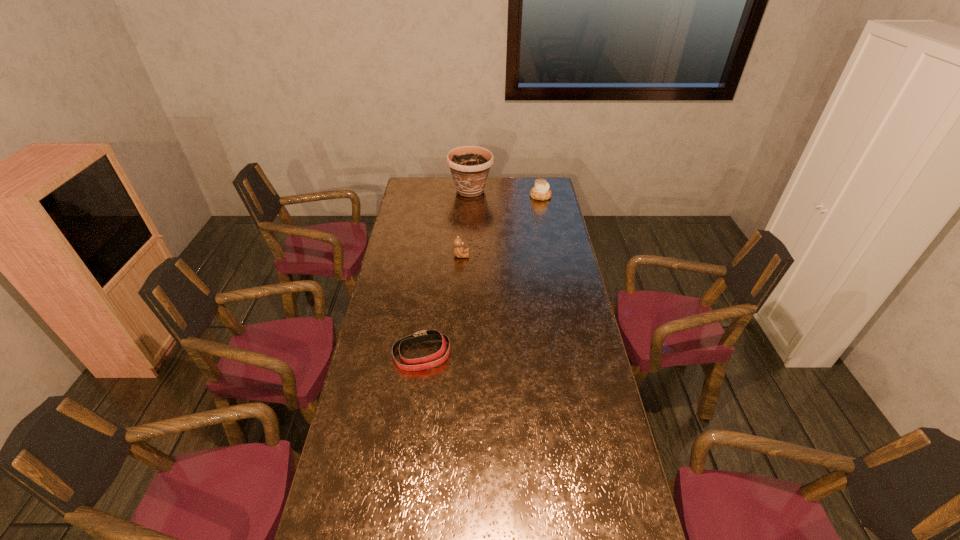
Image resolution: width=960 pixels, height=540 pixels. I want to click on the tallest object, so click(469, 165).

Identify the location of the rightmost object. This screenshot has height=540, width=960. (541, 191).

Identify the location of the third farthest object. This screenshot has height=540, width=960. (458, 249).

Locate an element on the screen. Image resolution: width=960 pixels, height=540 pixels. the nearest object is located at coordinates (426, 362).

Locate an element on the screen. Image resolution: width=960 pixels, height=540 pixels. the shortest object is located at coordinates (426, 362).

You are a GUI agent. You are given a task and a screenshot of the screen. Output one action in this format:
    pyautogui.click(x=<x>, y=<y>)
    Task: Click on the free space located 0.140m on the front of the tallest object
    
    Given the screenshot: What is the action you would take?
    pyautogui.click(x=469, y=218)

Find the location of a particular element. The height and width of the screenshot is (540, 960). free space located on the front of the pastry is located at coordinates (544, 215).

The width and height of the screenshot is (960, 540). In order to click on vacant point located on the face of the teddy bear in this screenshot , I will do `click(493, 255)`.

Where is `vacant space located on the right of the dog collar`? vacant space located on the right of the dog collar is located at coordinates (544, 355).

The width and height of the screenshot is (960, 540). What are the coordinates of `flowerpot situated at the far edge` in the screenshot? It's located at (469, 165).